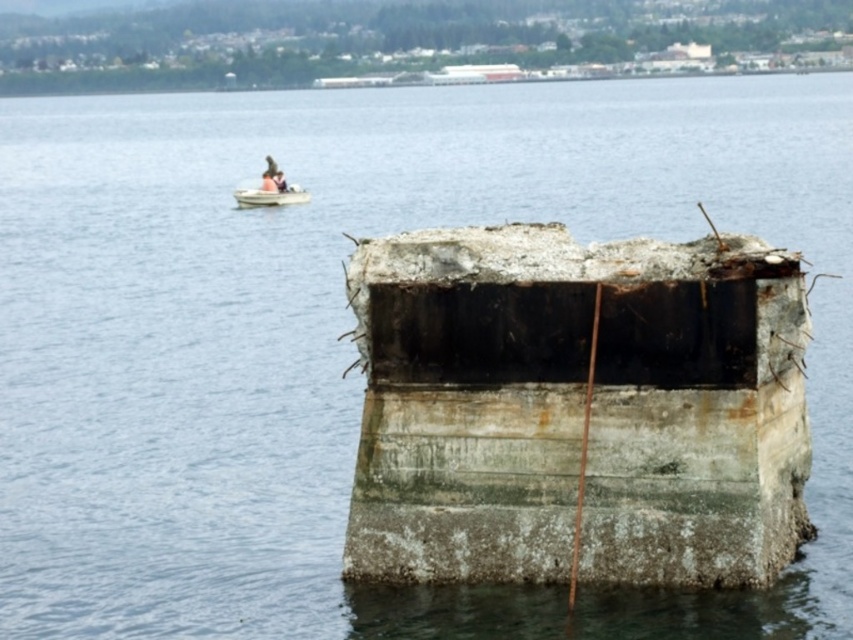
Based on the photo, you are standing on the shore and see the rusty concrete dock at center and the white plastic boat at upper left. Which object is higher in elevation?

The rusty concrete dock at center is taller than the white plastic boat at upper left, so the dock is higher in elevation.

You are standing on the shore looking at the scene. Which object is nearer to you between the rusty concrete dock at center and the light brown wooden boat at upper left?

The rusty concrete dock at center is closer to the viewer than the light brown wooden boat at upper left.

You are a photographer planning to capture both the white plastic boat at upper left and the light brown wooden boat at upper left in your shot. Given their sizes, which boat should you focus on first to ensure both fit in the frame?

The white plastic boat at upper left is larger in size than the light brown wooden boat at upper left, so you should focus on the white plastic boat at upper left first to accommodate its larger size and ensure both fit in the frame.